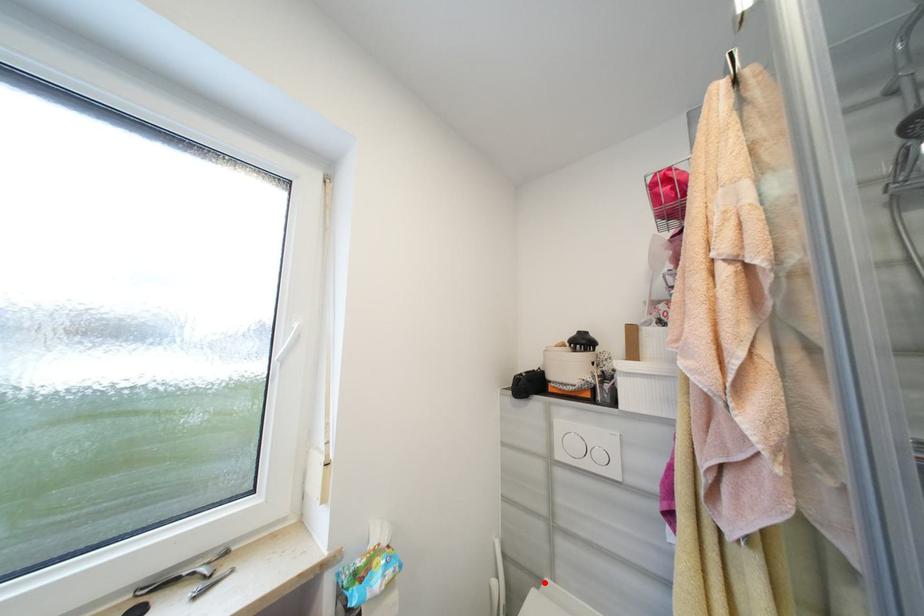
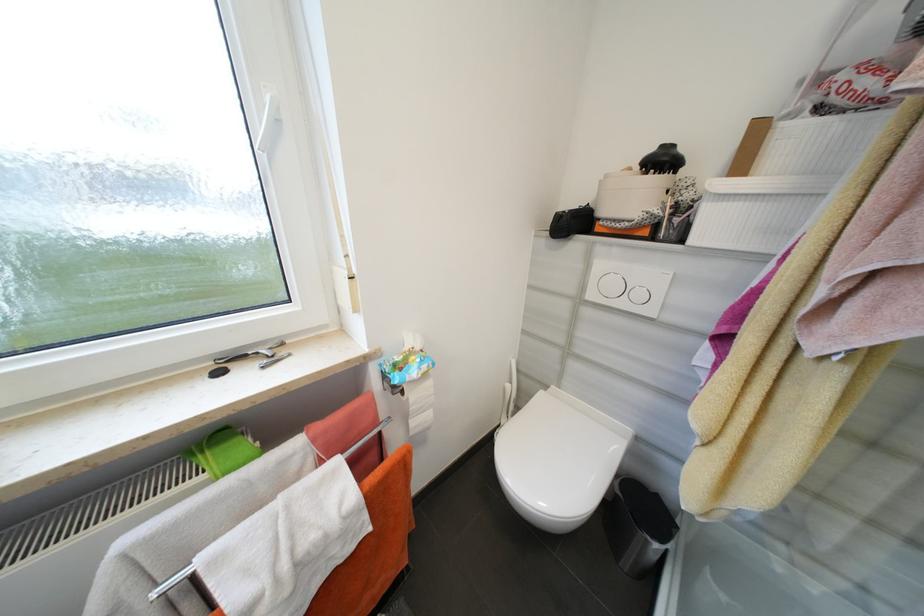
Find the pixel in the second image that matches the highlighted location in the first image.

(552, 387)